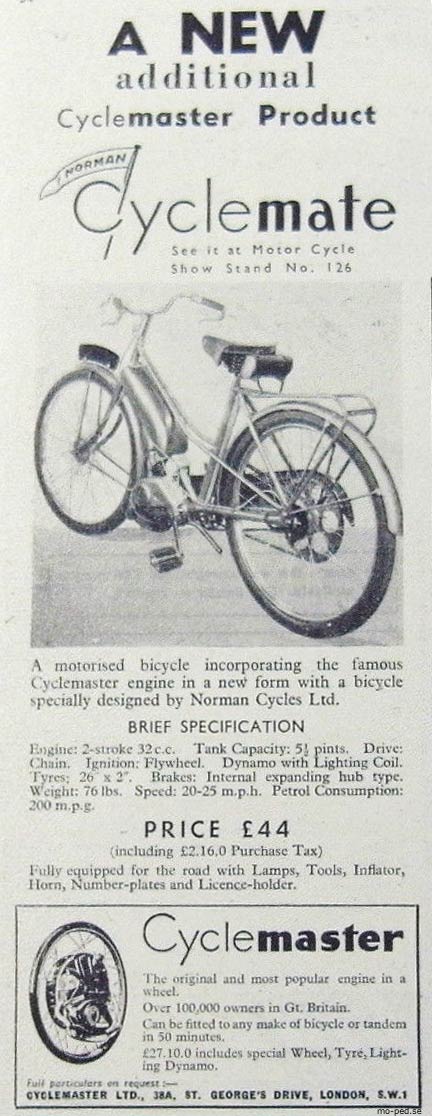
You are a GUI agent. You are given a task and a screenshot of the screen. Output one action in this format:
    pyautogui.click(x=<x>, y=<y>)
    Task: Click on the handle
    The height and width of the screenshot is (1116, 432).
    Given the screenshot: What is the action you would take?
    pyautogui.click(x=211, y=299)